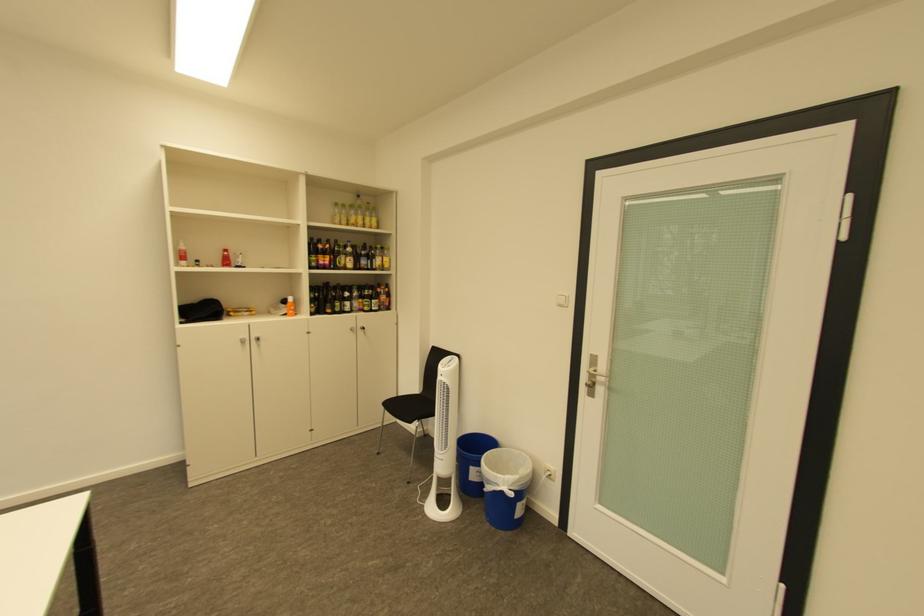
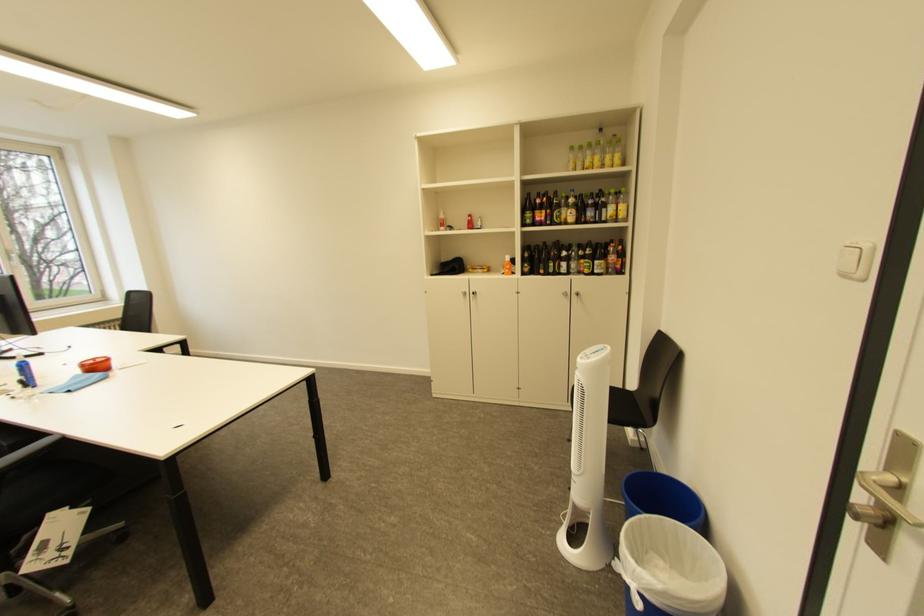
In the second image, find the point that corresponds to [454,368] in the first image.

(591, 359)